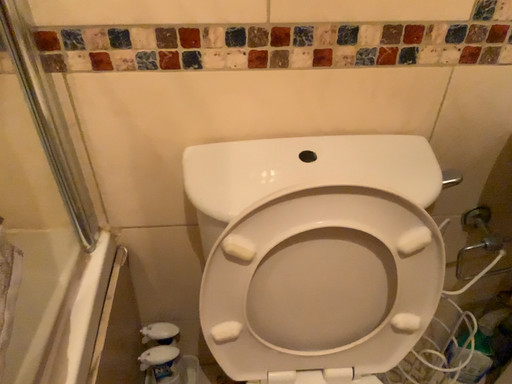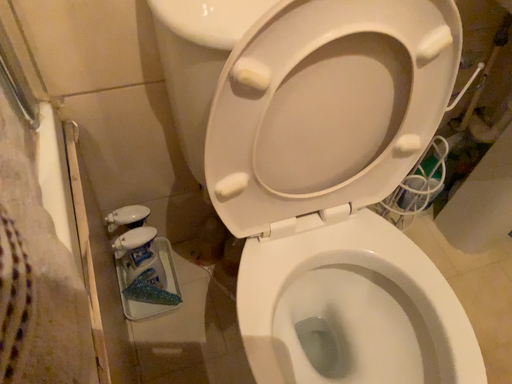
Question: Which way did the camera rotate in the video?

Choices:
 (A) rotated left
 (B) rotated right

Answer: (B)